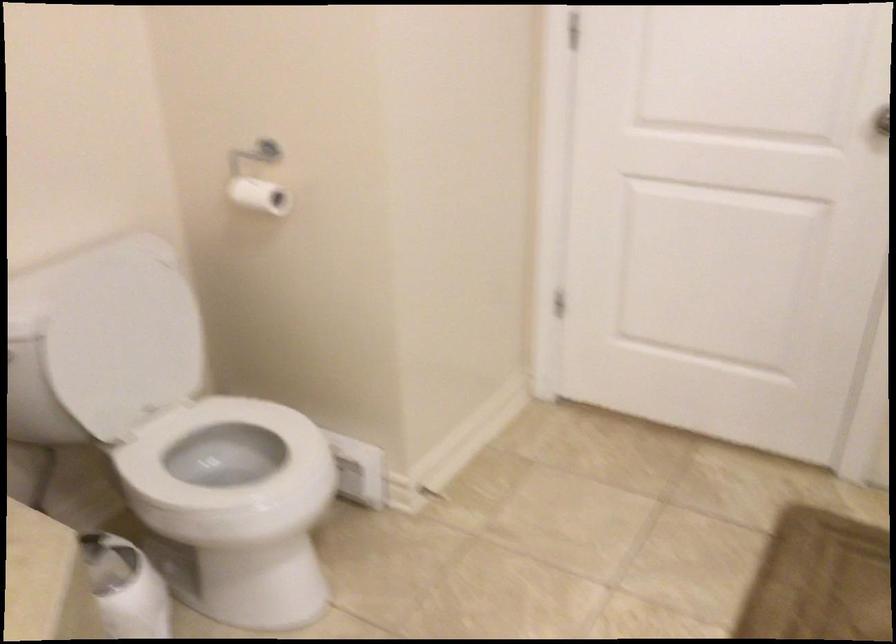
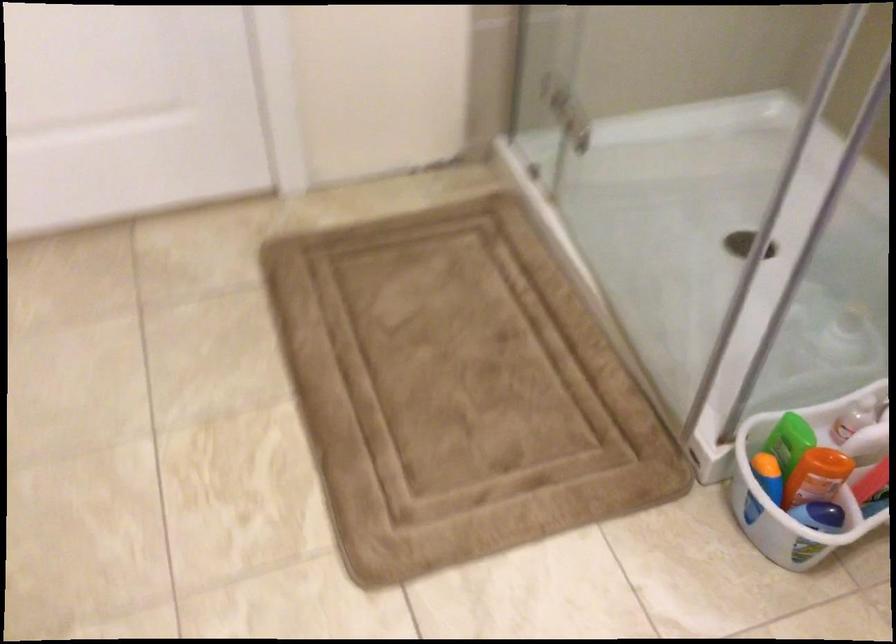
First-person continuous shooting, in which direction is the camera rotating?

The rotation direction of the camera is right-down.